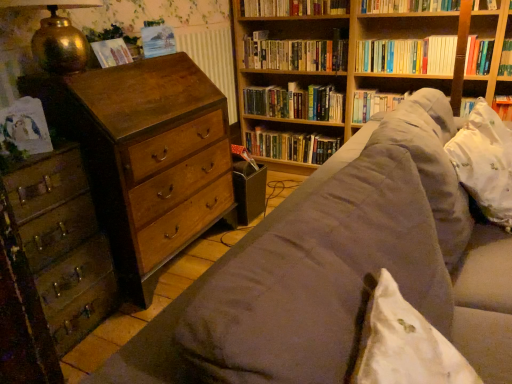
Question: Is wooden chest of drawers at left, placed as the second chest of drawers when sorted from left to right, facing towards suede-like brown couch at center?

Choices:
 (A) yes
 (B) no

Answer: (A)

Question: From the image's perspective, is wooden chest of drawers at left, placed as the second chest of drawers when sorted from left to right, under suede-like brown couch at center?

Choices:
 (A) no
 (B) yes

Answer: (A)

Question: Would you say wooden chest of drawers at left, placed as the second chest of drawers when sorted from left to right, contains suede-like brown couch at center?

Choices:
 (A) no
 (B) yes

Answer: (A)

Question: Does wooden chest of drawers at left, which is the 1th chest of drawers from right to left, have a lesser width compared to suede-like brown couch at center?

Choices:
 (A) yes
 (B) no

Answer: (A)

Question: Is wooden chest of drawers at left, which is the 1th chest of drawers from right to left, far from suede-like brown couch at center?

Choices:
 (A) yes
 (B) no

Answer: (B)

Question: Does wooden chest of drawers at left, which is the 1th chest of drawers from right to left, appear on the right side of suede-like brown couch at center?

Choices:
 (A) no
 (B) yes

Answer: (A)

Question: Is wooden chest of drawers at left, arranged as the first chest of drawers when viewed from the left, oriented away from gold textured lamp at upper left?

Choices:
 (A) no
 (B) yes

Answer: (A)

Question: Is wooden chest of drawers at left, the second chest of drawers viewed from the right, closer to camera compared to gold textured lamp at upper left?

Choices:
 (A) yes
 (B) no

Answer: (A)

Question: Is gold textured lamp at upper left inside wooden chest of drawers at left, the second chest of drawers viewed from the right?

Choices:
 (A) yes
 (B) no

Answer: (B)

Question: Can you confirm if wooden chest of drawers at left, arranged as the first chest of drawers when viewed from the left, is bigger than gold textured lamp at upper left?

Choices:
 (A) yes
 (B) no

Answer: (A)

Question: Would you consider wooden chest of drawers at left, the second chest of drawers viewed from the right, to be distant from gold textured lamp at upper left?

Choices:
 (A) no
 (B) yes

Answer: (A)

Question: Is wooden chest of drawers at left, the second chest of drawers viewed from the right, taller than gold textured lamp at upper left?

Choices:
 (A) no
 (B) yes

Answer: (B)

Question: Does wooden chest of drawers at left, placed as the second chest of drawers when sorted from left to right, come in front of hardcover books at upper right, which ranks as the third book in bottom-to-top order?

Choices:
 (A) no
 (B) yes

Answer: (B)